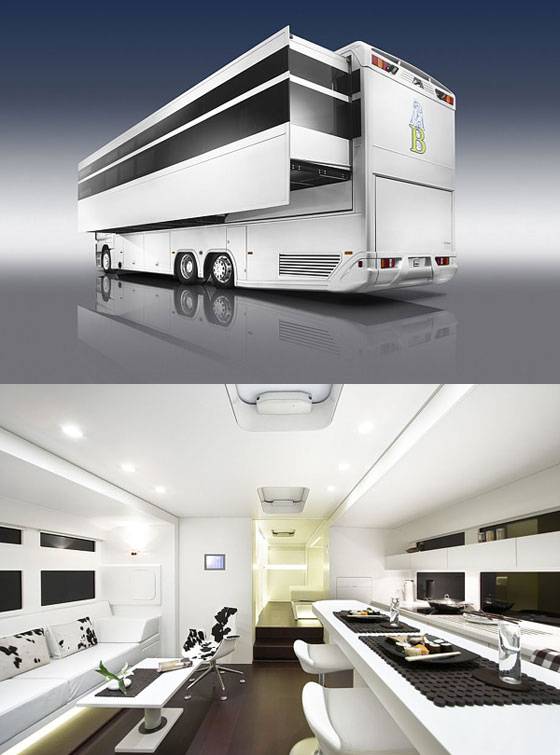
What are the coordinates of `stairs` in the screenshot? It's located at (278, 633).